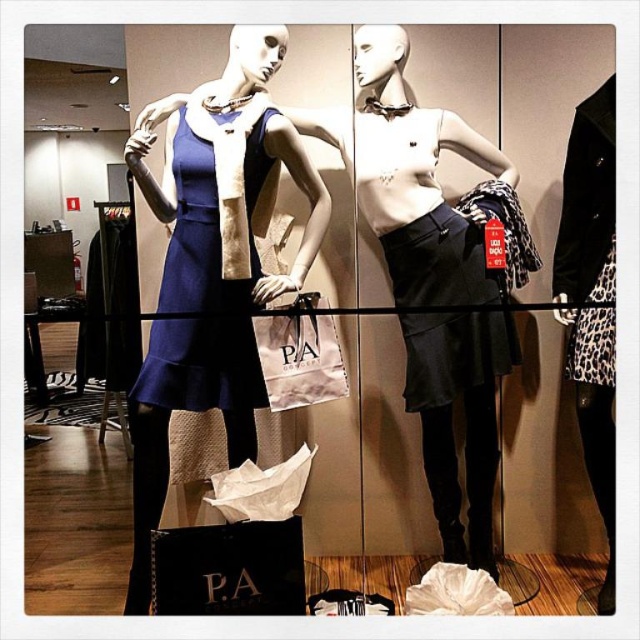
You are a store employee arranging the mannequins. You need to place a 30 cm wide accessory between the two mannequins. Given that the distance between the matte blue dress at center and the matte blue fabric dress at center is 40 cm, will the accessory fit?

The distance between the matte blue dress at center and the matte blue fabric dress at center is 40 cm. The accessory is 30 cm wide, so it will fit as the space is wider than the accessory.

You are standing in front of a retail display with two mannequins. You notice a specific point marked at coordinates point (172, 214). Can you estimate how far this point is from your current position?

The point (172, 214) is 1.94 meters from the camera, so it is approximately 1.94 meters away from your current position.

You are a customer in the store and want to buy a dress that reaches your knees. You see the matte blue dress at center and the matte blue fabric dress at center. Which one is longer?

The matte blue dress at center is taller than the matte blue fabric dress at center, so the matte blue dress at center is longer and reaches the knees.